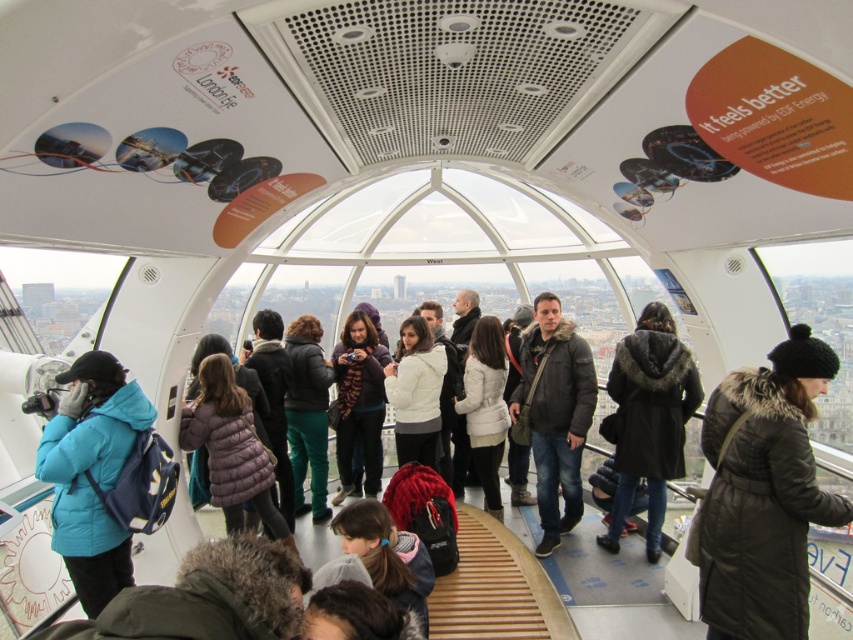
Where is `dark gray jacket at center`? This screenshot has width=853, height=640. dark gray jacket at center is located at coordinates (555, 413).

Can you confirm if dark gray jacket at center is positioned below teal fabric jacket at center?

Actually, dark gray jacket at center is above teal fabric jacket at center.

In order to click on dark gray jacket at center in this screenshot , I will do `click(555, 413)`.

Is matte blue jacket at left to the left of white fuzzy coat at center from the viewer's perspective?

Yes, matte blue jacket at left is to the left of white fuzzy coat at center.

Between matte blue jacket at left and white fuzzy coat at center, which one has less height?

matte blue jacket at left

Measure the distance between matte blue jacket at left and camera.

matte blue jacket at left and camera are 125.98 meters apart.

Identify the location of matte blue jacket at left. (91, 472).

Looking at this image, is purple puffer jacket at center thinner than white fuzzy coat at center?

No.

What do you see at coordinates (231, 449) in the screenshot? The width and height of the screenshot is (853, 640). I see `purple puffer jacket at center` at bounding box center [231, 449].

The width and height of the screenshot is (853, 640). What are the coordinates of `purple puffer jacket at center` in the screenshot? It's located at (231, 449).